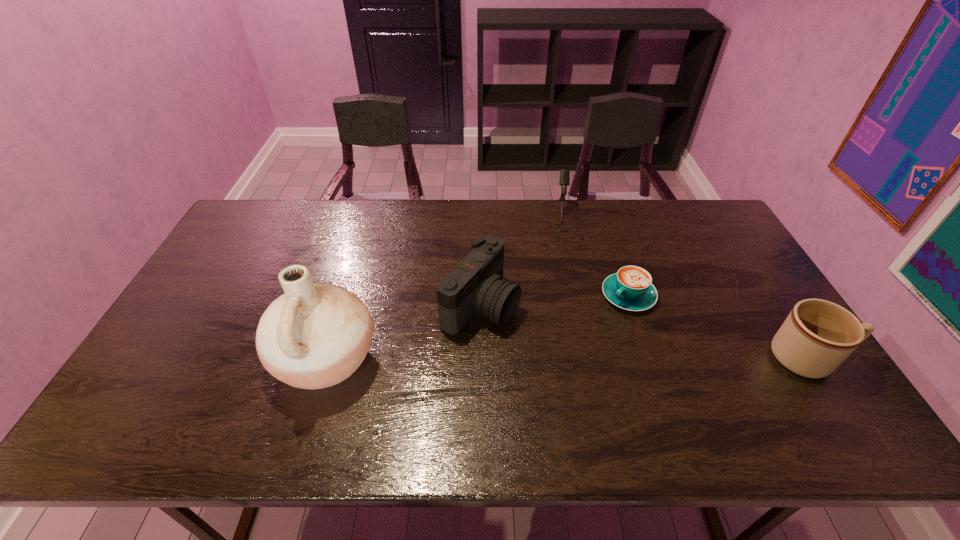
Locate an element on the screen. This screenshot has height=540, width=960. pottery that is positioned at the near edge is located at coordinates tap(314, 336).

This screenshot has height=540, width=960. I want to click on mug that is at the near edge, so click(x=818, y=335).

I want to click on object located at the right edge, so click(818, 335).

Locate an element on the screen. This screenshot has height=540, width=960. object situated at the near right corner is located at coordinates (818, 335).

Where is `vacant space at the far edge`? vacant space at the far edge is located at coordinates (398, 215).

Find the location of a particular element. The image size is (960, 540). vacant region at the near edge of the desktop is located at coordinates (206, 380).

What are the coordinates of `vacant space at the left edge of the desktop` in the screenshot? It's located at pyautogui.click(x=231, y=285).

Find the location of `vacant area at the right edge`. vacant area at the right edge is located at coordinates (x=761, y=352).

Locate an element on the screen. The width and height of the screenshot is (960, 540). vacant space at the far right corner is located at coordinates (697, 227).

Find the location of a particular element. vacant area between the microphone and the rightmost object is located at coordinates (684, 289).